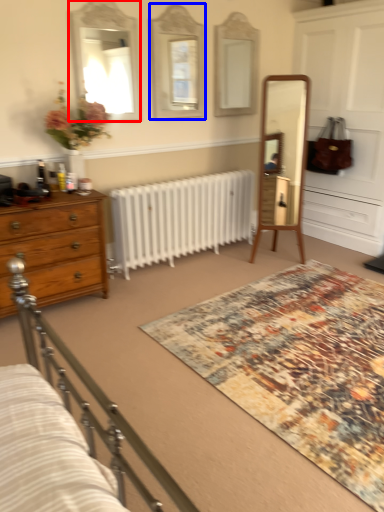
Question: Which object appears closest to the camera in this image, mirror (highlighted by a red box) or mirror (highlighted by a blue box)?

Choices:
 (A) mirror
 (B) mirror

Answer: (A)